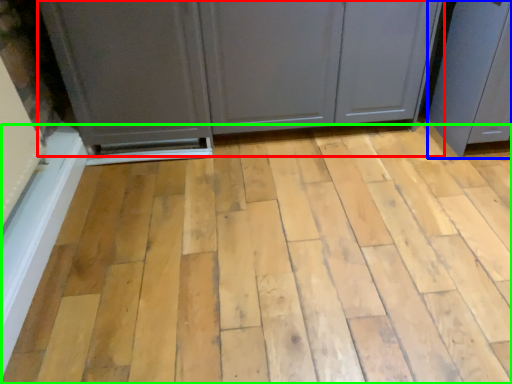
Question: Considering the real-world distances, which object is farthest from cupboard (highlighted by a red box)? screen door (highlighted by a blue box) or plank (highlighted by a green box)?

Choices:
 (A) screen door
 (B) plank

Answer: (B)